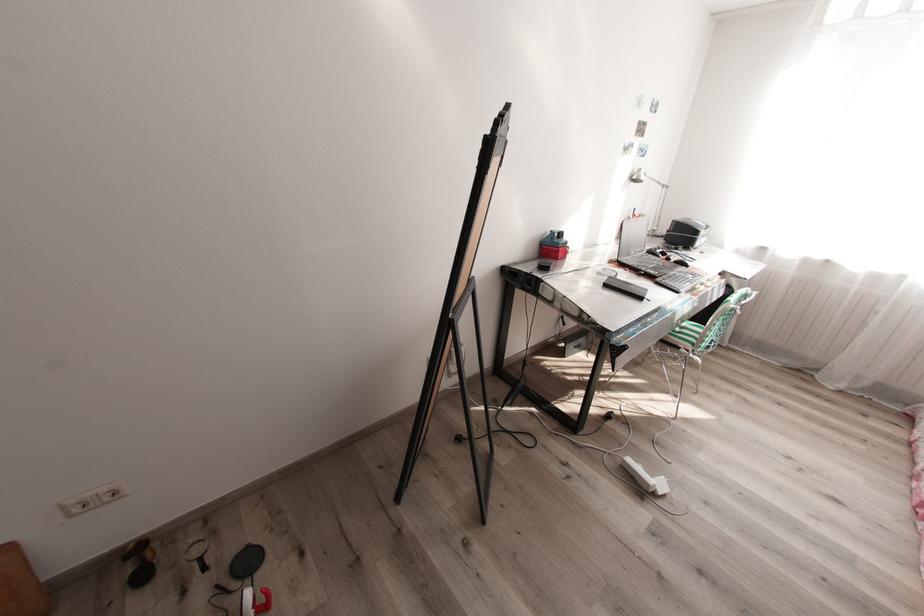
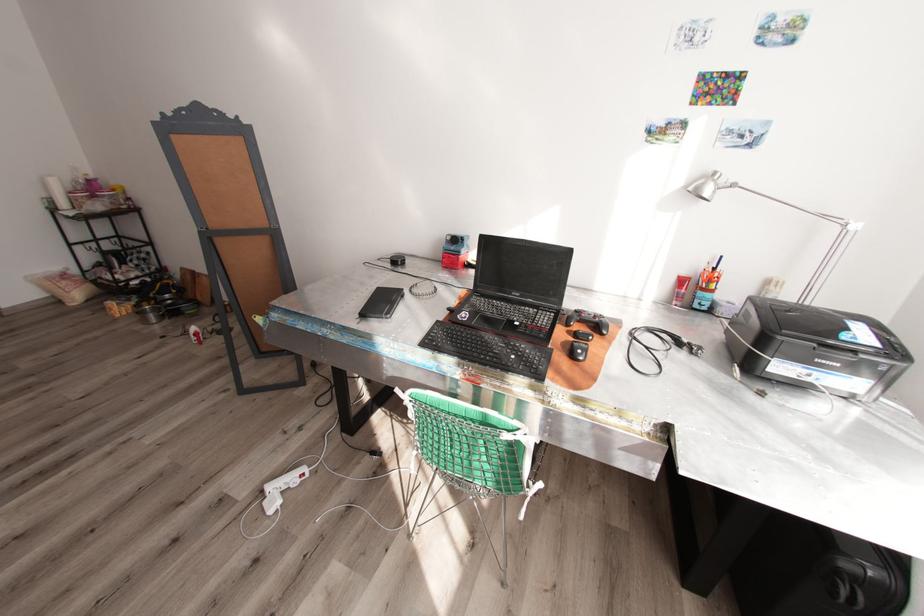
In the second image, find the point that corresponds to pixel 638 252 in the first image.

(523, 294)